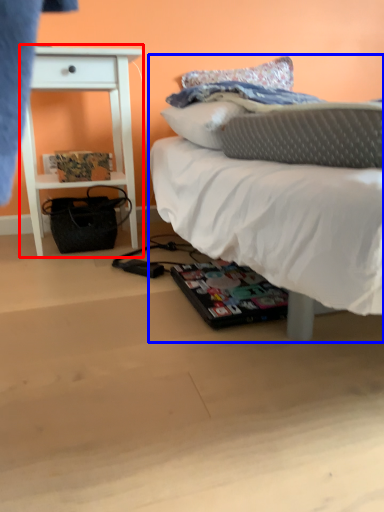
Question: Which of the following is the farthest to the observer, nightstand (highlighted by a red box) or bed (highlighted by a blue box)?

Choices:
 (A) nightstand
 (B) bed

Answer: (A)